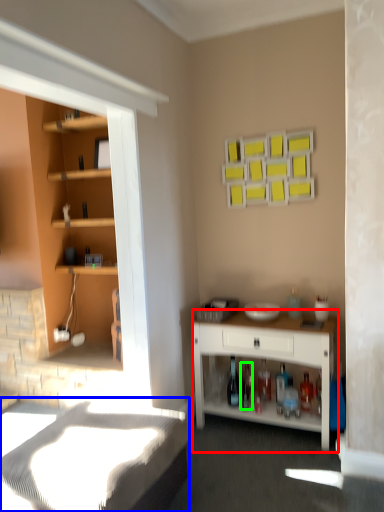
Question: Which object is the closest to the desk (highlighted by a red box)? Choose among these: bed frame (highlighted by a blue box) or bottle (highlighted by a green box).

Choices:
 (A) bed frame
 (B) bottle

Answer: (B)